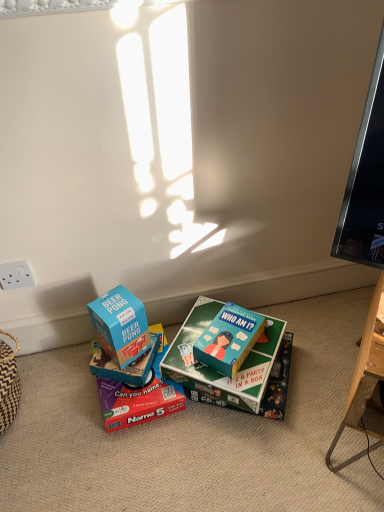
Question: Is matte cardboard box at center, the 3th box positioned from the left, positioned behind blue cardboard box at center, acting as the 5th box starting from the right?

Choices:
 (A) yes
 (B) no

Answer: (A)

Question: Is matte cardboard box at center, which is counted as the 3th box, starting from the right, not near blue cardboard box at center, the 1th box from the left?

Choices:
 (A) yes
 (B) no

Answer: (B)

Question: Is matte cardboard box at center, which is counted as the 3th box, starting from the right, to the right of blue cardboard box at center, the 1th box from the left, from the viewer's perspective?

Choices:
 (A) yes
 (B) no

Answer: (A)

Question: Can you confirm if matte cardboard box at center, which is counted as the 3th box, starting from the right, is taller than blue cardboard box at center, the 1th box from the left?

Choices:
 (A) no
 (B) yes

Answer: (A)

Question: Considering the relative sizes of matte cardboard box at center, which is counted as the 3th box, starting from the right, and blue cardboard box at center, acting as the 5th box starting from the right, in the image provided, is matte cardboard box at center, which is counted as the 3th box, starting from the right, shorter than blue cardboard box at center, acting as the 5th box starting from the right,?

Choices:
 (A) yes
 (B) no

Answer: (A)

Question: Is matte cardboard box at center, the 3th box positioned from the left, located outside blue cardboard box at center, the 1th box from the left?

Choices:
 (A) yes
 (B) no

Answer: (A)

Question: Could you tell me if teal matte board game at center, which is the 5th box from left to right, is turned towards blue cardboard box at center, acting as the 5th box starting from the right?

Choices:
 (A) no
 (B) yes

Answer: (A)

Question: Is teal matte board game at center, which is counted as the 1th box, starting from the right, thinner than blue cardboard box at center, acting as the 5th box starting from the right?

Choices:
 (A) yes
 (B) no

Answer: (B)

Question: Can you confirm if teal matte board game at center, which is counted as the 1th box, starting from the right, is positioned to the left of blue cardboard box at center, the 1th box from the left?

Choices:
 (A) yes
 (B) no

Answer: (B)

Question: Is teal matte board game at center, which is the 5th box from left to right, not near blue cardboard box at center, the 1th box from the left?

Choices:
 (A) no
 (B) yes

Answer: (A)

Question: Is the depth of teal matte board game at center, which is the 5th box from left to right, greater than that of blue cardboard box at center, the 1th box from the left?

Choices:
 (A) no
 (B) yes

Answer: (B)

Question: Considering the relative positions of teal matte board game at center, which is counted as the 1th box, starting from the right, and blue cardboard box at center, acting as the 5th box starting from the right, in the image provided, is teal matte board game at center, which is counted as the 1th box, starting from the right, to the right of blue cardboard box at center, acting as the 5th box starting from the right, from the viewer's perspective?

Choices:
 (A) no
 (B) yes

Answer: (B)

Question: Considering the relative sizes of blue cardboard box at center, the second box when ordered from left to right, and white plastic power outlet at lower left in the image provided, is blue cardboard box at center, the second box when ordered from left to right, bigger than white plastic power outlet at lower left?

Choices:
 (A) no
 (B) yes

Answer: (B)